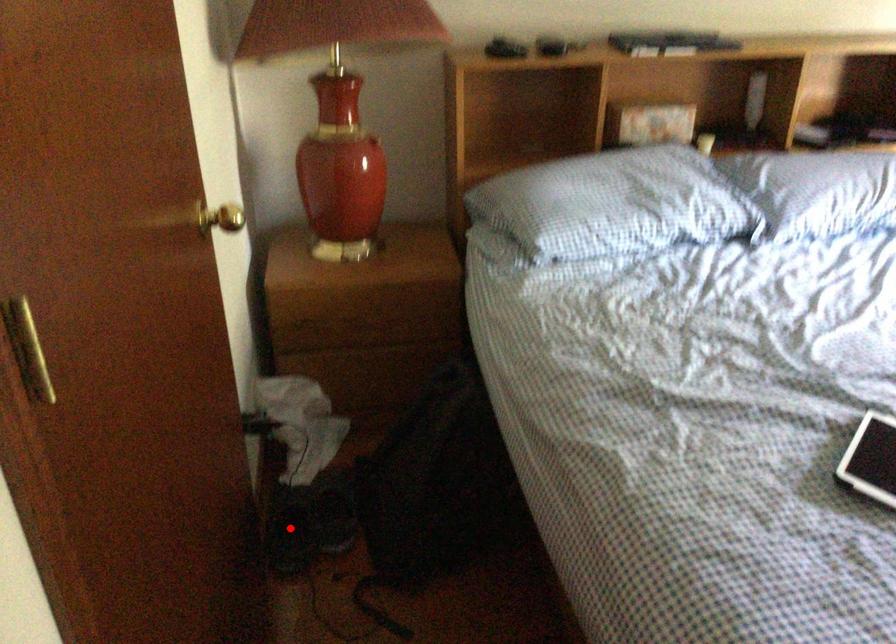
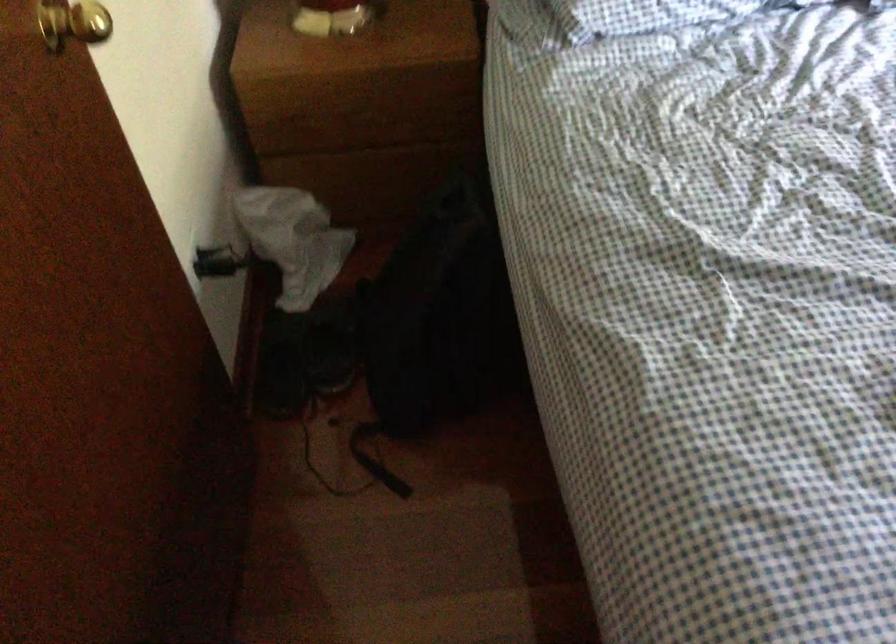
Question: I am providing you with two images of the same scene from different viewpoints. In image1, a red point is highlighted. Considering the same 3D point in image2, which of the following is correct?

Choices:
 (A) It is closer
 (B) It is farther

Answer: (A)